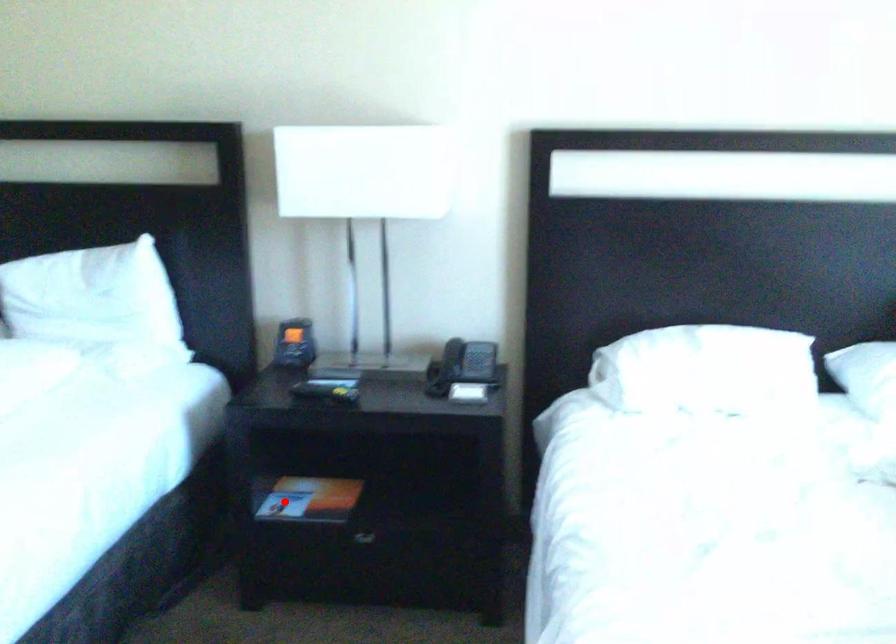
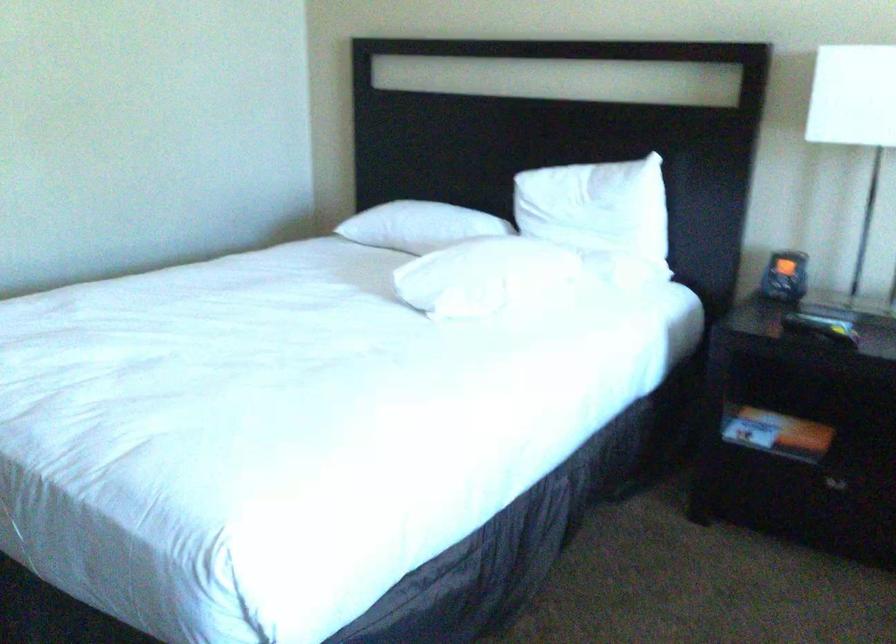
Find the pixel in the second image that matches the highlighted location in the first image.

(752, 427)